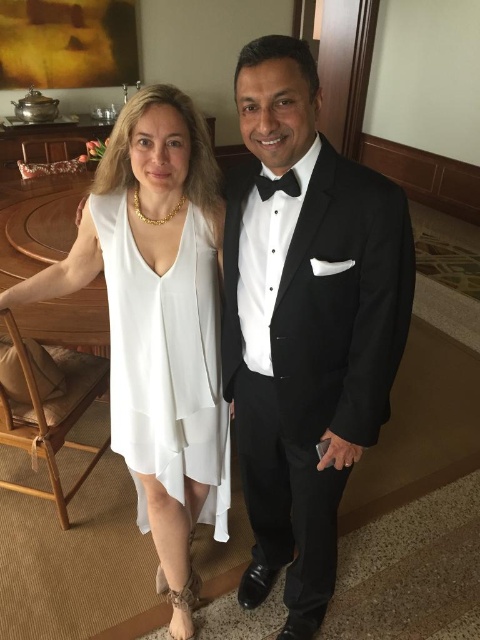
Question: Can you confirm if black satin tuxedo at center is positioned above white sheer dress at center?

Choices:
 (A) yes
 (B) no

Answer: (A)

Question: Does black satin tuxedo at center appear on the right side of black satin bow tie at center?

Choices:
 (A) no
 (B) yes

Answer: (B)

Question: Which of the following is the farthest from the observer?

Choices:
 (A) black satin bow tie at center
 (B) black satin tuxedo at center

Answer: (A)

Question: Which of these objects is positioned farthest from the white sheer dress at center?

Choices:
 (A) black satin bow tie at center
 (B) white silk dress at center

Answer: (A)

Question: Is black satin tuxedo at center wider than black satin bow tie at center?

Choices:
 (A) no
 (B) yes

Answer: (B)

Question: Which point is farther from the camera taking this photo?

Choices:
 (A) (156, 282)
 (B) (111, 275)

Answer: (B)